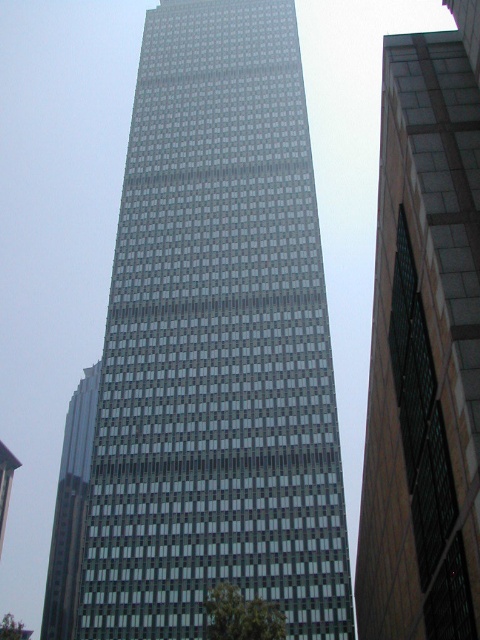
Looking at this image, between glassy reflective skyscraper at center and glassy reflective skyscraper at left, which one is positioned higher?

glassy reflective skyscraper at center

Between point (420, 35) and point (96, 396), which one is positioned behind?

The point (96, 396) is more distant.

Does point (456, 538) lie in front of point (60, 582)?

Yes, point (456, 538) is in front of point (60, 582).

The width and height of the screenshot is (480, 640). I want to click on glassy reflective skyscraper at center, so click(x=424, y=346).

Is glassy steel tower at center to the left of glassy reflective skyscraper at center from the viewer's perspective?

Correct, you'll find glassy steel tower at center to the left of glassy reflective skyscraper at center.

Looking at this image, who is higher up, glassy steel tower at center or glassy reflective skyscraper at center?

glassy steel tower at center is above.

Describe the element at coordinates (216, 344) in the screenshot. Image resolution: width=480 pixels, height=640 pixels. I see `glassy steel tower at center` at that location.

Identify the location of glassy steel tower at center. This screenshot has height=640, width=480. (216, 344).

Can you confirm if glassy steel tower at center is positioned above glassy reflective skyscraper at left?

Yes, glassy steel tower at center is above glassy reflective skyscraper at left.

Is glassy steel tower at center taller than glassy reflective skyscraper at left?

Correct, glassy steel tower at center is much taller as glassy reflective skyscraper at left.

Who is more forward, (180, 288) or (72, 548)?

Positioned in front is point (180, 288).

Where is `glassy steel tower at center`? Image resolution: width=480 pixels, height=640 pixels. glassy steel tower at center is located at coordinates (216, 344).